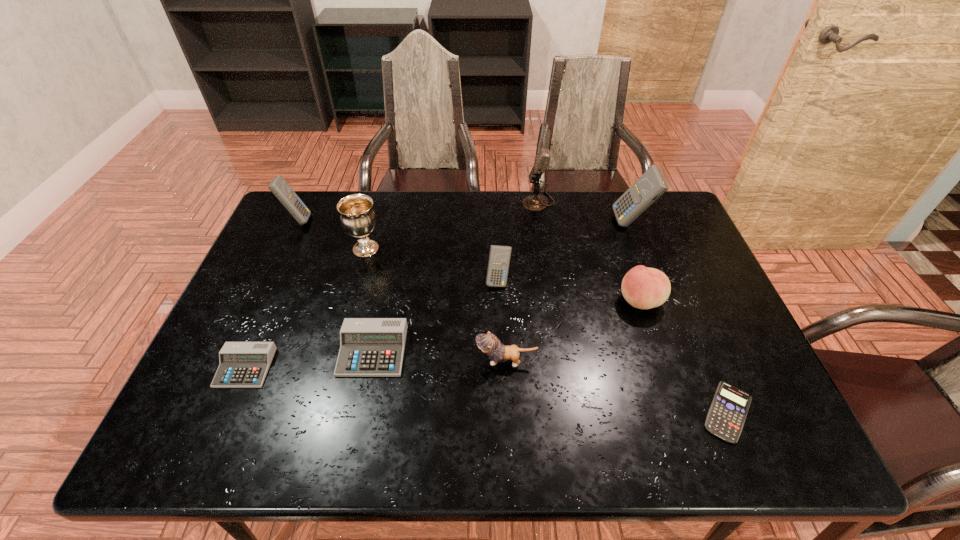
Find the location of `blank area located 0.250m on the right of the left gray calculator`. blank area located 0.250m on the right of the left gray calculator is located at coordinates (374, 367).

Where is `free space located 0.300m on the back of the smallest blue calculator`? free space located 0.300m on the back of the smallest blue calculator is located at coordinates (676, 287).

I want to click on microphone positioned at the far edge, so click(x=535, y=203).

Identify the location of object at the near edge. (727, 414).

I want to click on peach located at the right edge, so click(x=644, y=288).

The image size is (960, 540). Identify the location of object that is at the far left corner. (279, 187).

This screenshot has height=540, width=960. Find the location of `object present at the far right corner`. object present at the far right corner is located at coordinates (651, 185).

Locate an element on the screen. Image resolution: width=960 pixels, height=540 pixels. object situated at the near right corner is located at coordinates (727, 414).

I want to click on vacant region at the far edge of the desktop, so click(501, 190).

Where is `free spot at the near edge of the desktop`? The height and width of the screenshot is (540, 960). free spot at the near edge of the desktop is located at coordinates (604, 435).